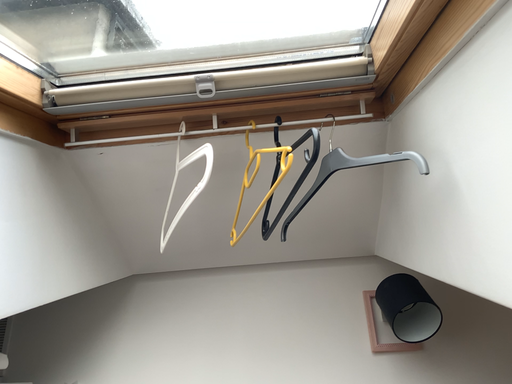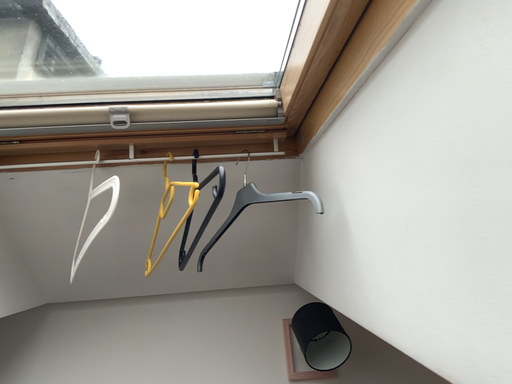
Question: Which way did the camera rotate in the video?

Choices:
 (A) rotated right
 (B) rotated left

Answer: (A)